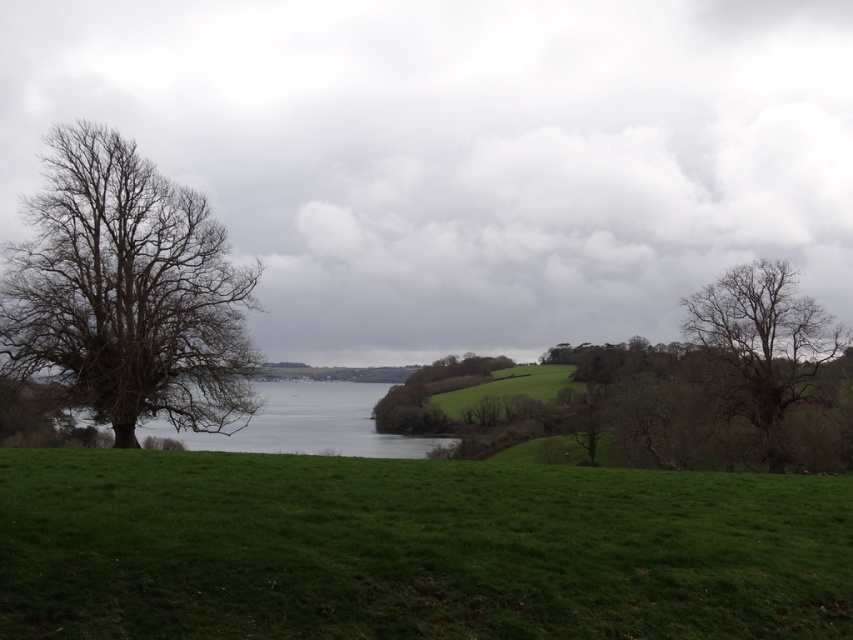
You are an artist planning to sketch this landscape. You want to ensure the bare branches at left and the bare branches tree at right are proportionally accurate. Which of the two should you draw smaller in your sketch?

The bare branches at left should be drawn smaller because it occupies less space than the bare branches tree at right.

You are an observer standing in the middle of the grassy field. You see the bare branches at left and the bare branches tree at right. Which one is located to the east? Please explain your reasoning based on the scene description.

The bare branches at left is positioned on the left side of the bare branches tree at right. Since the observer is facing the scene with the water in the middle ground and the grassy field sloping downward towards it, the left side would correspond to the eastern direction if the sun is setting in the west. However, the scene description mentions an overcast sky, so the exact direction cannot be determined based on sunlight. The positioning in the image places the bare branches at left to the east of the 2.

Consider the image. You are a hiker standing at the edge of the green grassy field at lower center and want to reach the bare branches tree at right. Which direction should you walk to get closer to the tree?

The green grassy field at lower center has a smaller size compared to the bare branches tree at right, so you should walk towards the right direction to get closer to the tree.